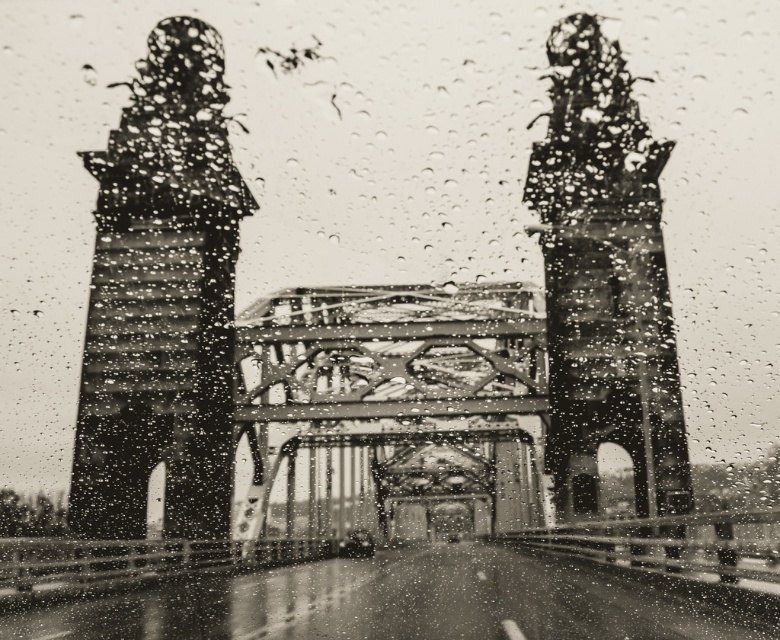
Can you confirm if metallic bridge at center is wider than rusty metal bell tower at center?

Yes, metallic bridge at center is wider than rusty metal bell tower at center.

Can you confirm if metallic bridge at center is shorter than rusty metal bell tower at center?

Yes, metallic bridge at center is shorter than rusty metal bell tower at center.

Is point (312, 400) closer to camera compared to point (591, 424)?

No, it is not.

At what (x,y) coordinates should I click in order to perform the action: click on metallic bridge at center. Please return your answer as a coordinate pair (x, y). The width and height of the screenshot is (780, 640). Looking at the image, I should click on (392, 410).

Is metallic bridge at center shorter than rusty metal tower at left?

Correct, metallic bridge at center is not as tall as rusty metal tower at left.

How distant is metallic bridge at center from rusty metal tower at left?

metallic bridge at center and rusty metal tower at left are 27.43 meters apart.

Which is behind, point (509, 376) or point (206, 477)?

The point (509, 376) is behind.

Find the location of a particular element. The width and height of the screenshot is (780, 640). metallic bridge at center is located at coordinates (392, 410).

Between rusty metal tower at left and rusty metal bell tower at center, which one appears on the left side from the viewer's perspective?

rusty metal tower at left is more to the left.

Between point (112, 216) and point (557, 220), which one is positioned behind?

The point (112, 216) is behind.

Is point (245, 205) positioned before point (550, 426)?

No.

Where is `rusty metal tower at left`? Image resolution: width=780 pixels, height=640 pixels. rusty metal tower at left is located at coordinates (161, 300).